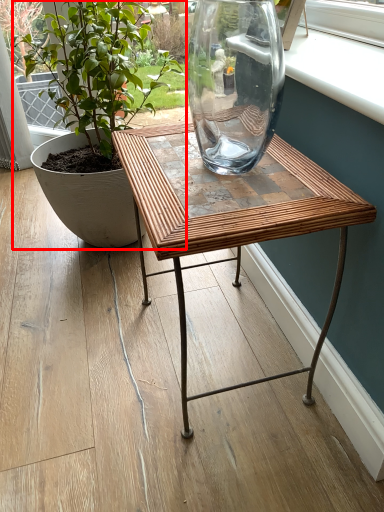
Question: From the image's perspective, where is houseplant (annotated by the red box) located relative to table?

Choices:
 (A) above
 (B) below

Answer: (A)